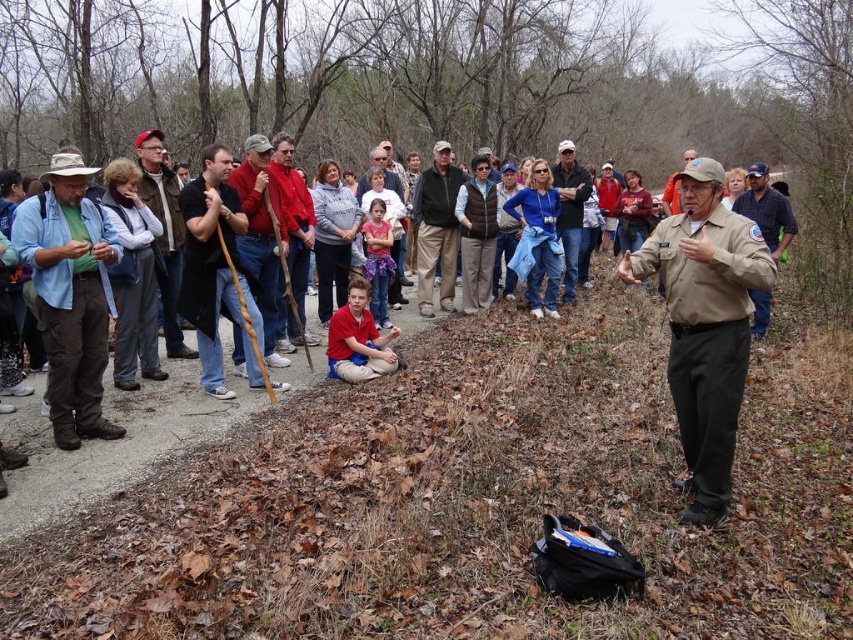
You are a photographer trying to capture a group photo of the light blue denim shirt at left and the khaki uniform shirt at center. If you want to ensure both shirts are in focus, which one should you adjust your camera focus to prioritize based on their sizes?

The light blue denim shirt at left is larger in width than the khaki uniform shirt at center. To ensure both are in focus, prioritize focusing on the closer shirt, but since the question doesn not specify distance, adjust for the larger shirt as depth of field might require it.

You are a photographer carrying a camera and need to place it on the brown leather jacket at left. Is the distance between your camera and the jacket sufficient to allow you to reach it without moving your feet?

The distance between the camera and the brown leather jacket at left is 5.73 meters, which is too far to reach without moving your feet.

You are standing in the park and want to place a small bench between the two points marked as point (x=148, y=193) and point (x=395, y=253). Which point should the bench be closer to in order to be nearer to the park ranger who is facing the crowd?

The bench should be placed closer to point (x=148, y=193) because it is closer to the viewer, and the park ranger is facing the crowd, implying he is closer to the viewer as well.